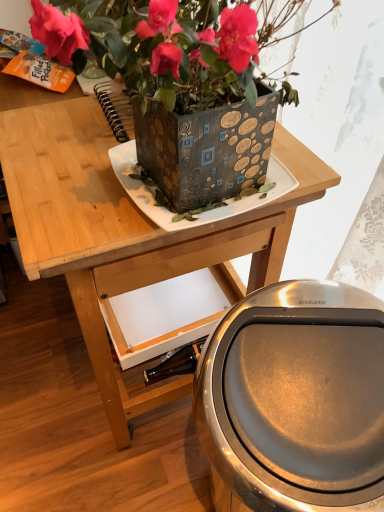
Question: In terms of height, does metallic textured planter at upper center look taller or shorter compared to polished stainless steel trash can at lower right?

Choices:
 (A) short
 (B) tall

Answer: (A)

Question: From the image's perspective, is metallic textured planter at upper center located above or below polished stainless steel trash can at lower right?

Choices:
 (A) below
 (B) above

Answer: (B)

Question: Based on their relative distances, which object is nearer to the wooden table at upper center?

Choices:
 (A) metallic textured planter at upper center
 (B) polished stainless steel trash can at lower right

Answer: (A)

Question: Estimate the real-world distances between objects in this image. Which object is farther from the wooden table at upper center?

Choices:
 (A) metallic textured planter at upper center
 (B) polished stainless steel trash can at lower right

Answer: (B)